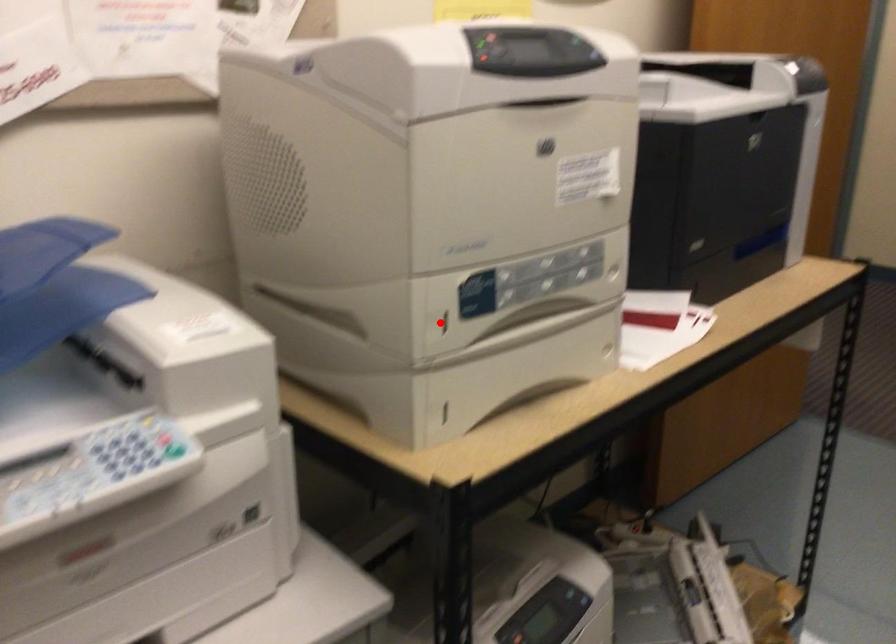
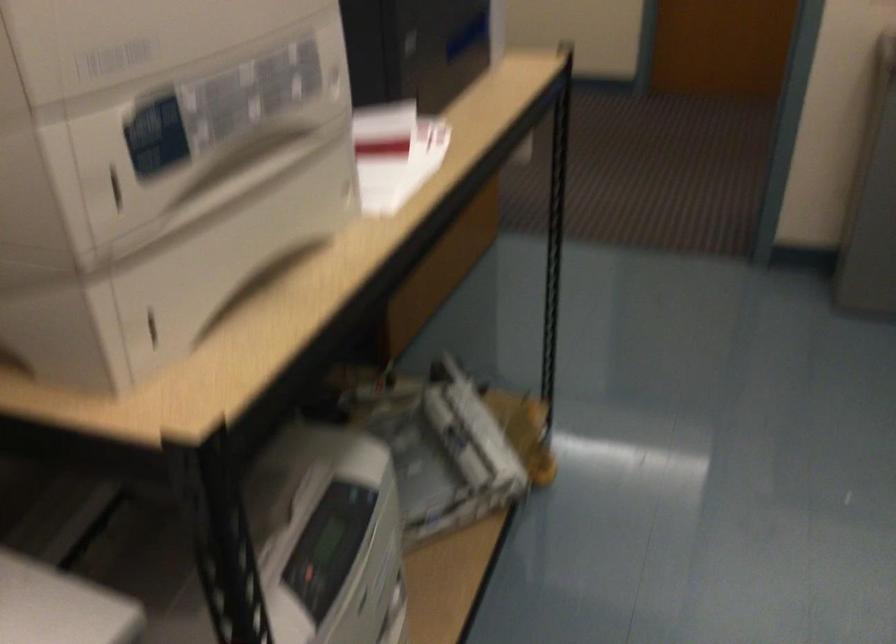
Question: I am providing you with two images of the same scene from different viewpoints. Given a red point in image1, look at the same physical point in image2. Is it:

Choices:
 (A) Closer to the viewpoint
 (B) Farther from the viewpoint

Answer: (A)